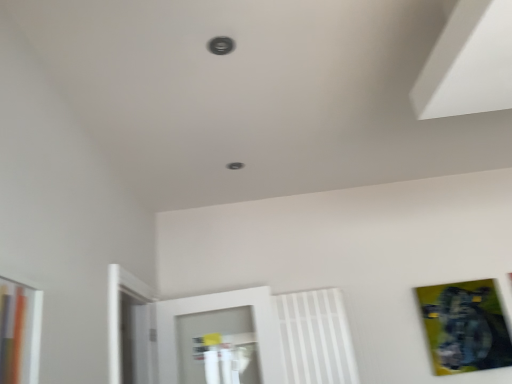
Question: Can you confirm if metallic gold picture frame at lower right is shorter than metallic circular hole at center, marked as the 2th hole in a top-to-bottom arrangement?

Choices:
 (A) no
 (B) yes

Answer: (A)

Question: Is metallic gold picture frame at lower right to the right of metallic circular hole at center, marked as the 2th hole in a top-to-bottom arrangement, from the viewer's perspective?

Choices:
 (A) no
 (B) yes

Answer: (B)

Question: Can you confirm if metallic gold picture frame at lower right is thinner than metallic circular hole at center, marked as the 2th hole in a top-to-bottom arrangement?

Choices:
 (A) yes
 (B) no

Answer: (A)

Question: Would you say metallic gold picture frame at lower right is outside metallic circular hole at center, placed as the 1th hole when sorted from bottom to top?

Choices:
 (A) no
 (B) yes

Answer: (B)

Question: From a real-world perspective, does metallic gold picture frame at lower right sit lower than metallic circular hole at center, which is counted as the second hole, starting from the front?

Choices:
 (A) no
 (B) yes

Answer: (B)

Question: Is metallic gold picture frame at lower right positioned before metallic circular hole at center, which is counted as the second hole, starting from the front?

Choices:
 (A) yes
 (B) no

Answer: (B)

Question: Does white plastic radiator at center have a greater height compared to metallic circular hole at center, marked as the 2th hole in a top-to-bottom arrangement?

Choices:
 (A) yes
 (B) no

Answer: (A)

Question: Does white plastic radiator at center have a greater width compared to metallic circular hole at center, which is counted as the first hole, starting from the back?

Choices:
 (A) no
 (B) yes

Answer: (A)

Question: Is white plastic radiator at center oriented towards metallic circular hole at center, placed as the 1th hole when sorted from bottom to top?

Choices:
 (A) yes
 (B) no

Answer: (B)

Question: Is white plastic radiator at center to the right of metallic circular hole at center, which is counted as the first hole, starting from the back, from the viewer's perspective?

Choices:
 (A) yes
 (B) no

Answer: (A)

Question: Considering the relative sizes of white plastic radiator at center and metallic circular hole at center, marked as the 2th hole in a top-to-bottom arrangement, in the image provided, is white plastic radiator at center thinner than metallic circular hole at center, marked as the 2th hole in a top-to-bottom arrangement,?

Choices:
 (A) yes
 (B) no

Answer: (A)

Question: Is white plastic radiator at center not within metallic circular hole at center, which is counted as the first hole, starting from the back?

Choices:
 (A) yes
 (B) no

Answer: (A)

Question: Can you confirm if metallic circular hole at center, marked as the 2th hole in a top-to-bottom arrangement, is shorter than metallic circular hole at upper center, which appears as the second hole when ordered from the bottom?

Choices:
 (A) yes
 (B) no

Answer: (B)